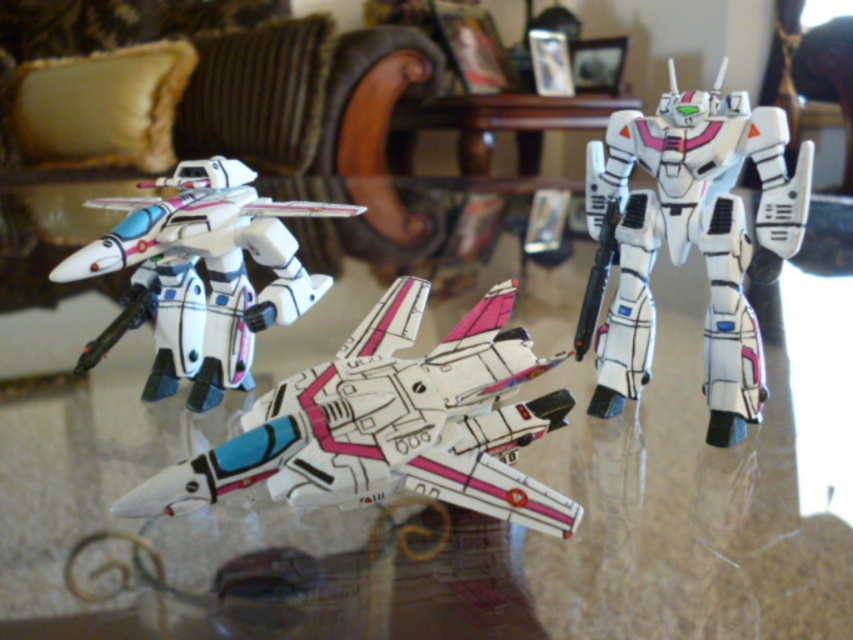
Can you confirm if white glossy plane at center is thinner than white glossy robot at left?

No, white glossy plane at center is not thinner than white glossy robot at left.

Does point (393, 308) come farther from viewer compared to point (138, 227)?

No, it is in front of (138, 227).

Identify the location of white glossy plane at center. (390, 422).

Is transparent glass table at center above white matte robot at center?

No.

Locate an element on the screen. transparent glass table at center is located at coordinates [451, 508].

Is point (810, 634) positioned in front of point (801, 205)?

Yes, it is.

Where is `transparent glass table at center`? The width and height of the screenshot is (853, 640). transparent glass table at center is located at coordinates (451, 508).

Is white matte robot at center above white glossy robot at left?

Yes, white matte robot at center is above white glossy robot at left.

Can you confirm if white matte robot at center is taller than white glossy robot at left?

Yes.

This screenshot has height=640, width=853. What do you see at coordinates (688, 241) in the screenshot?
I see `white matte robot at center` at bounding box center [688, 241].

In order to click on white matte robot at center in this screenshot , I will do `click(688, 241)`.